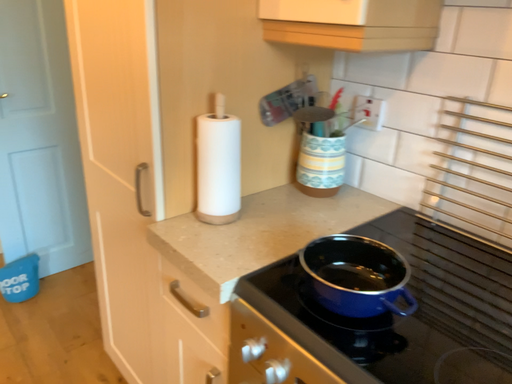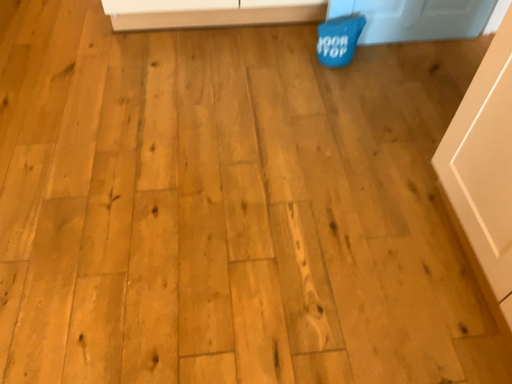
Question: Which way did the camera rotate in the video?

Choices:
 (A) rotated downward
 (B) rotated upward

Answer: (A)